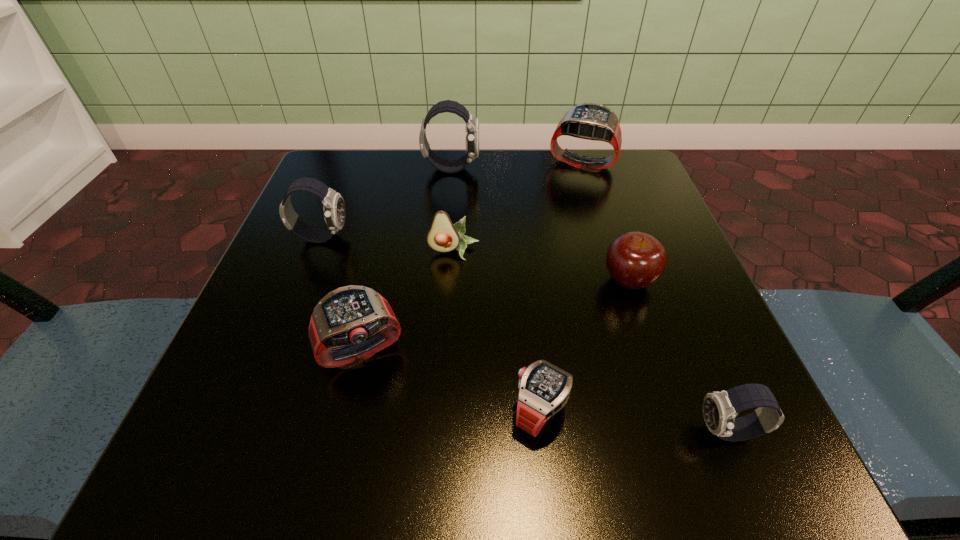
Where is `vacant space at the left edge`? vacant space at the left edge is located at coordinates (330, 271).

Locate an element on the screen. The width and height of the screenshot is (960, 540). free space at the right edge is located at coordinates (746, 377).

This screenshot has height=540, width=960. Identify the location of vacant space at the far left corner of the desktop. 345,192.

Find the location of `vacant region at the far right corner of the desktop`. vacant region at the far right corner of the desktop is located at coordinates point(623,157).

The image size is (960, 540). Find the location of `vacant area at the near right corner`. vacant area at the near right corner is located at coordinates (728, 442).

Identify the location of vacant point located between the second nearest dark watch and the nearest red watch. The height and width of the screenshot is (540, 960). (431, 325).

The height and width of the screenshot is (540, 960). In order to click on empty location between the avocado and the rightmost red watch in this screenshot , I will do `click(517, 207)`.

Where is `vacant space in between the farthest red watch and the third farthest watch`? This screenshot has width=960, height=540. vacant space in between the farthest red watch and the third farthest watch is located at coordinates (451, 200).

Image resolution: width=960 pixels, height=540 pixels. I want to click on free spot between the apple and the leftmost watch, so click(475, 258).

At what (x,y) coordinates should I click in order to perform the action: click on vacant area that lies between the shortest object and the smallest dark watch. Please return your answer as a coordinate pair (x, y). This screenshot has width=960, height=540. Looking at the image, I should click on (635, 422).